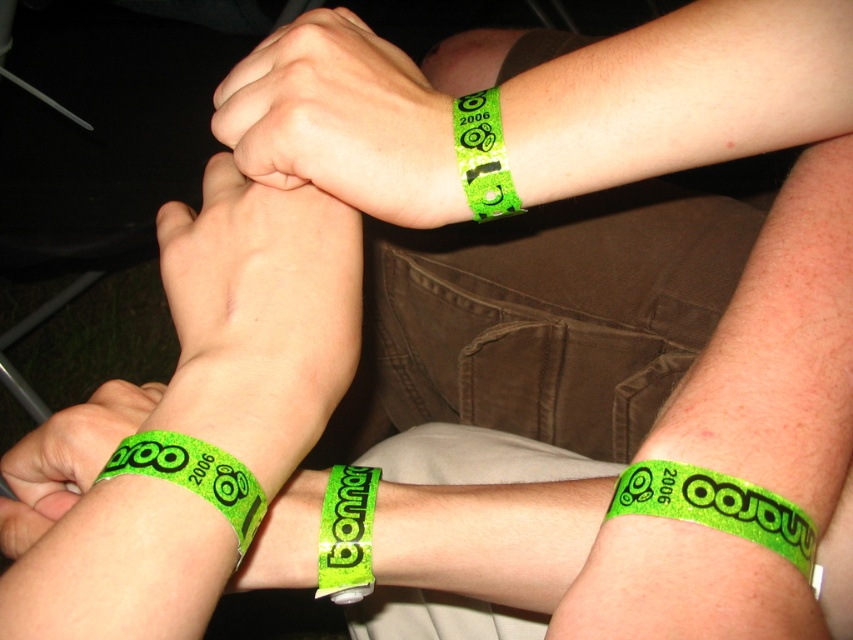
Question: Which point is farther from the camera taking this photo?

Choices:
 (A) (346, 579)
 (B) (496, 180)

Answer: (A)

Question: Which is farther from the green glitter wristband at lower left?

Choices:
 (A) green glittery wristband at lower left
 (B) green glittery wristband at lower center

Answer: (B)

Question: Is green glitter wristband at lower left above green glittery wristband at upper center?

Choices:
 (A) no
 (B) yes

Answer: (A)

Question: Does green glittery wristband at lower right appear on the right side of green glittery wristband at lower left?

Choices:
 (A) yes
 (B) no

Answer: (A)

Question: Which object is positioned farthest from the green glittery wristband at lower left?

Choices:
 (A) green fluorescent wristband at center
 (B) green glittery wristband at upper center
 (C) green glittery wristband at lower right

Answer: (B)

Question: Is the position of green glittery wristband at lower left more distant than that of green glittery wristband at upper center?

Choices:
 (A) yes
 (B) no

Answer: (B)